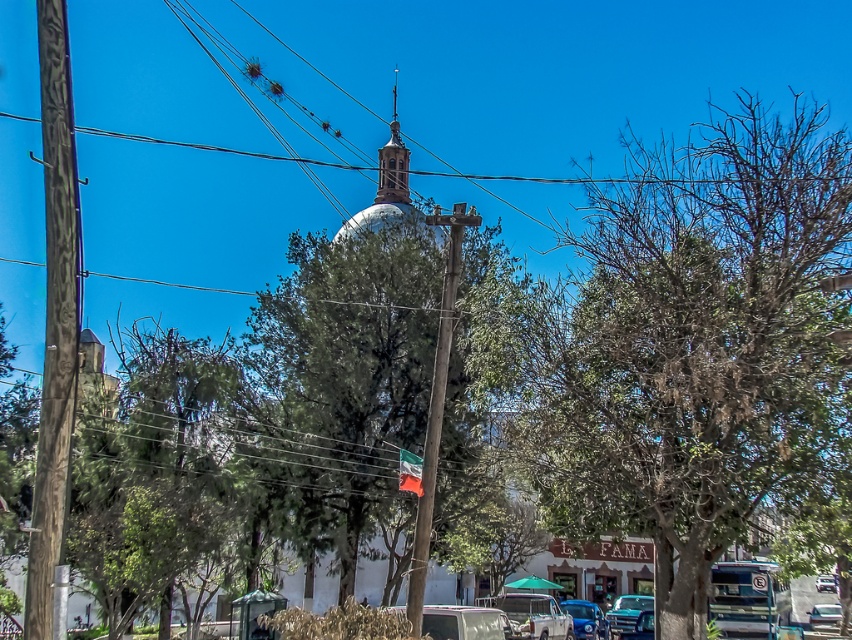
Question: Is matte white dome at center to the right of metallic silver truck at lower center from the viewer's perspective?

Choices:
 (A) no
 (B) yes

Answer: (A)

Question: Can you confirm if shiny silver car at center is positioned above metallic silver car at center?

Choices:
 (A) yes
 (B) no

Answer: (A)

Question: Which point is farther to the camera?

Choices:
 (A) metallic silver truck at lower center
 (B) metallic silver car at center

Answer: (B)

Question: Which object is the farthest from the metallic silver truck at lower center?

Choices:
 (A) metallic blue car at center
 (B) metallic silver car at lower right
 (C) shiny silver car at center
 (D) white matte van at lower center

Answer: (B)

Question: Is green leafy tree at upper right positioned before metallic silver car at center?

Choices:
 (A) no
 (B) yes

Answer: (B)

Question: Estimate the real-world distances between objects in this image. Which object is closer to the matte white dome at center?

Choices:
 (A) green leafy tree at upper right
 (B) metallic silver car at center
 (C) metallic silver truck at lower center
 (D) white matte van at lower center

Answer: (A)